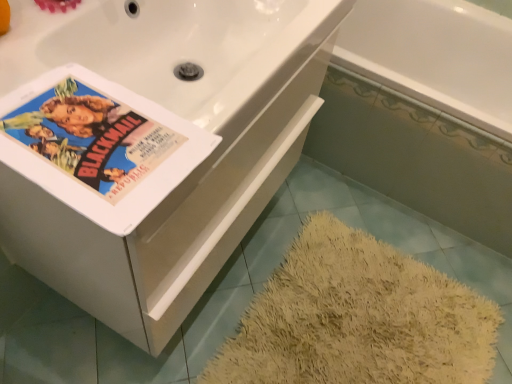
Question: Is white ceramic bathtub at upper right touching matte paper poster at upper left?

Choices:
 (A) no
 (B) yes

Answer: (A)

Question: Considering the relative sizes of white ceramic bathtub at upper right and matte paper poster at upper left in the image provided, is white ceramic bathtub at upper right bigger than matte paper poster at upper left?

Choices:
 (A) yes
 (B) no

Answer: (A)

Question: Is matte paper poster at upper left completely or partially inside white ceramic bathtub at upper right?

Choices:
 (A) yes
 (B) no

Answer: (B)

Question: Does white ceramic bathtub at upper right turn towards matte paper poster at upper left?

Choices:
 (A) no
 (B) yes

Answer: (A)

Question: Is white ceramic bathtub at upper right positioned before matte paper poster at upper left?

Choices:
 (A) yes
 (B) no

Answer: (B)

Question: Can you confirm if white ceramic bathtub at upper right is thinner than matte paper poster at upper left?

Choices:
 (A) yes
 (B) no

Answer: (B)

Question: Does white ceramic bathtub at upper right have a lesser width compared to white glossy bathtub at lower right, the first bath in the front-to-back sequence?

Choices:
 (A) yes
 (B) no

Answer: (A)

Question: Can you confirm if white ceramic bathtub at upper right is positioned to the left of white glossy bathtub at lower right, the first bath in the front-to-back sequence?

Choices:
 (A) no
 (B) yes

Answer: (B)

Question: Is the position of white ceramic bathtub at upper right more distant than that of white glossy bathtub at lower right, arranged as the second bath when viewed from the back?

Choices:
 (A) no
 (B) yes

Answer: (A)

Question: From the image's perspective, would you say white ceramic bathtub at upper right is positioned over white glossy bathtub at lower right, the first bath in the front-to-back sequence?

Choices:
 (A) yes
 (B) no

Answer: (B)

Question: Can you confirm if white ceramic bathtub at upper right is smaller than white glossy bathtub at lower right, arranged as the second bath when viewed from the back?

Choices:
 (A) yes
 (B) no

Answer: (A)

Question: Considering the relative positions of white ceramic bathtub at upper right and white glossy bathtub at lower right, arranged as the second bath when viewed from the back, in the image provided, is white ceramic bathtub at upper right to the right of white glossy bathtub at lower right, arranged as the second bath when viewed from the back, from the viewer's perspective?

Choices:
 (A) yes
 (B) no

Answer: (B)

Question: Can you confirm if white glossy bathtub at upper right, which is counted as the second bath, starting from the front, is thinner than matte paper poster at upper left?

Choices:
 (A) yes
 (B) no

Answer: (A)